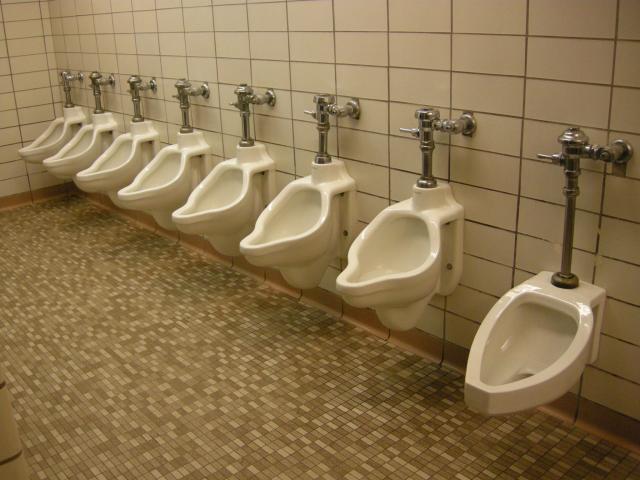
What are the coordinates of `urinals` in the screenshot? It's located at (536, 335), (388, 257), (296, 219), (227, 189), (170, 176), (108, 161), (83, 145), (56, 141).